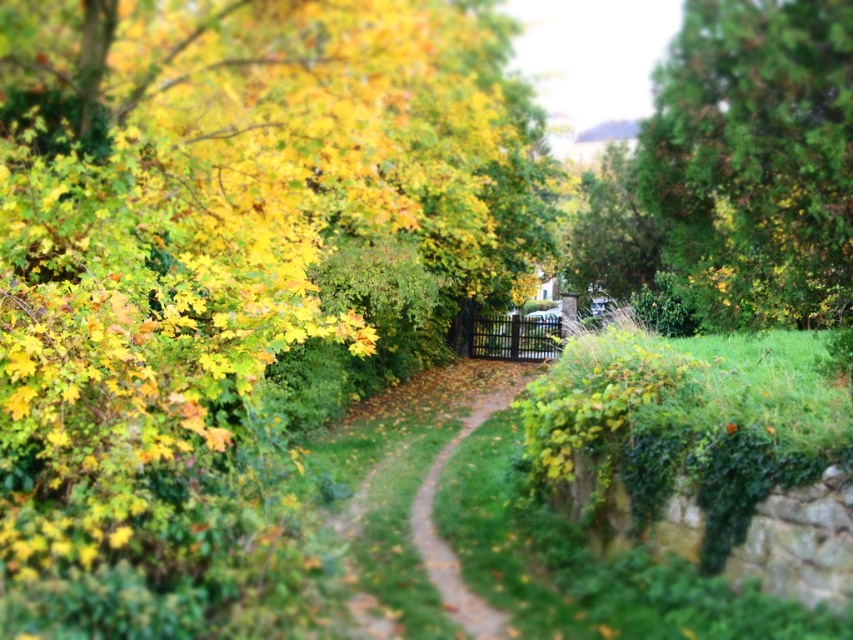
You are standing at the camera position and want to take a photo of the green textured tree at upper right. If your camera has a maximum focus range of 6 meters, will you be able to capture the tree in focus without moving closer?

The green textured tree at upper right and camera are 6.25 meters apart from each other. Since the maximum focus range is 6 meters, the distance exceeds the camera capability, so you won not be able to capture the tree in focus without moving closer.

You are standing on the green grassy trail at center and want to take a photo of the green textured tree at upper right. Since the trail is behind the tree, will the tree be in the foreground of your photo?

Yes, the green textured tree at upper right is in front of the green grassy trail at center, so it will appear in the foreground of your photo.

You are standing on the green grassy trail at center and want to take a photo of the green textured tree at upper right. In which direction should you point your camera to capture the tree in the frame?

You should point your camera to the right since the green textured tree at upper right is located to the right of the green grassy trail at center where you are standing.